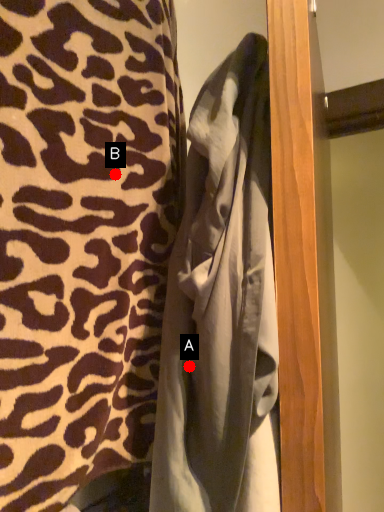
Question: Two points are circled on the image, labeled by A and B beside each circle. Which point is farther to the camera?

Choices:
 (A) A is further
 (B) B is further

Answer: (B)